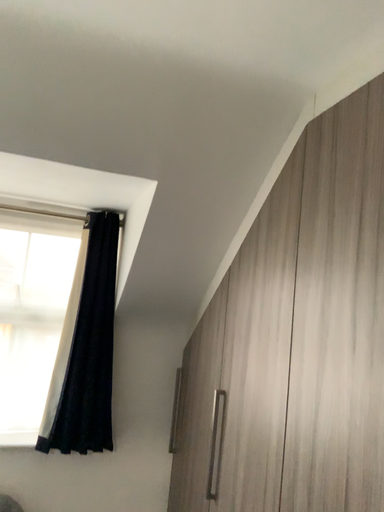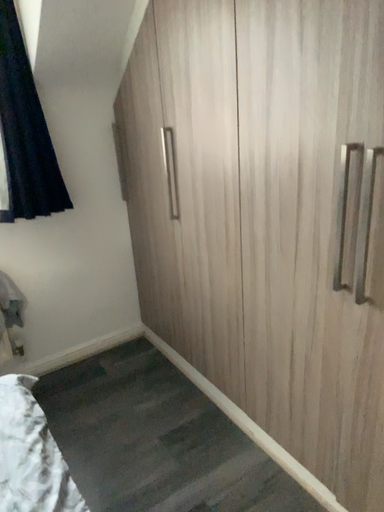
Question: How did the camera likely rotate when shooting the video?

Choices:
 (A) rotated left
 (B) rotated right

Answer: (B)